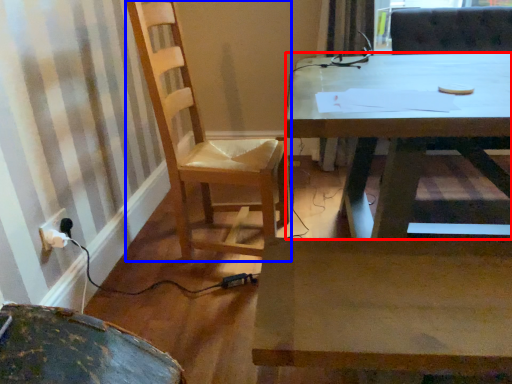
Question: Which point is closer to the camera, desk (highlighted by a red box) or chair (highlighted by a blue box)?

Choices:
 (A) desk
 (B) chair

Answer: (A)